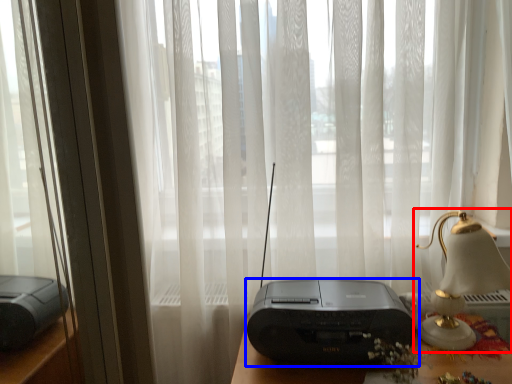
Question: Which of the following is the farthest to the observer, bedside lamp (highlighted by a red box) or printer (highlighted by a blue box)?

Choices:
 (A) bedside lamp
 (B) printer

Answer: (B)